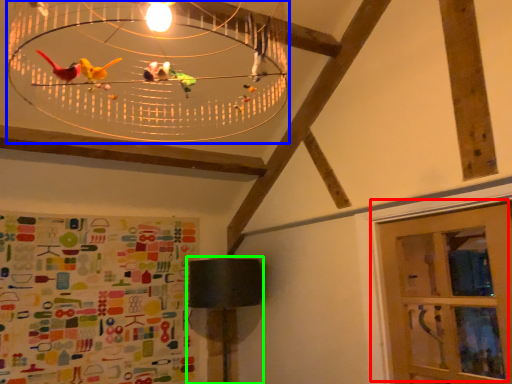
Question: Considering the real-world distances, which object is closest to door (highlighted by a red box)? chandelier (highlighted by a blue box) or table lamp (highlighted by a green box).

Choices:
 (A) chandelier
 (B) table lamp

Answer: (B)